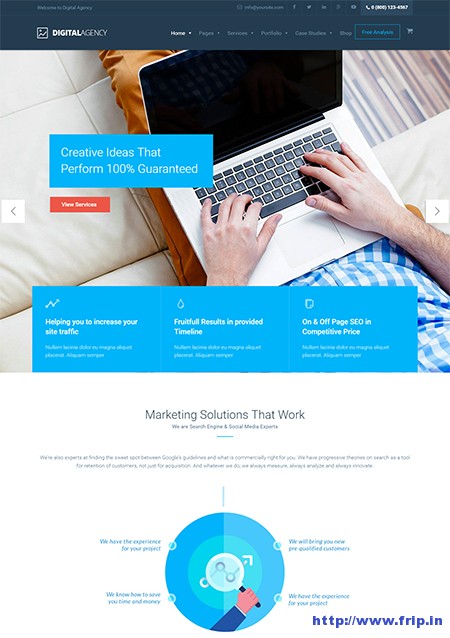
Identify the location of white couch. The width and height of the screenshot is (450, 638). (80, 249).